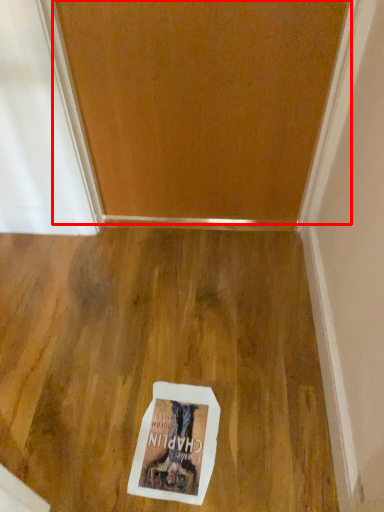
Question: Considering the relative positions of door (annotated by the red box) and postcard in the image provided, where is door (annotated by the red box) located with respect to the staircase?

Choices:
 (A) right
 (B) left

Answer: (A)